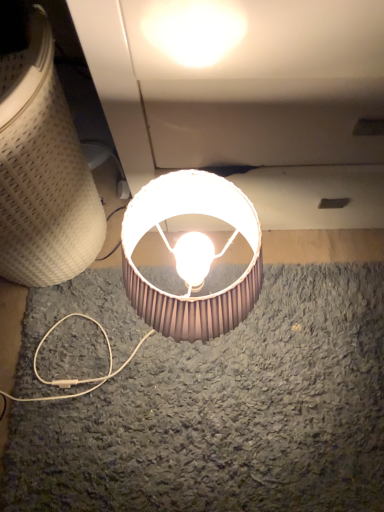
Question: Can you confirm if brown pleated lampshade at center, which is the 1th lamp from right to left, is positioned to the left of matte brown lampshade at lower center, acting as the second lamp starting from the right?

Choices:
 (A) yes
 (B) no

Answer: (B)

Question: From the image's perspective, is brown pleated lampshade at center, which is the 1th lamp from right to left, over matte brown lampshade at lower center, acting as the second lamp starting from the right?

Choices:
 (A) no
 (B) yes

Answer: (A)

Question: Could matte brown lampshade at lower center, marked as the 1th lamp in a left-to-right arrangement, be considered to be inside brown pleated lampshade at center, which is the 1th lamp from right to left?

Choices:
 (A) no
 (B) yes

Answer: (A)

Question: Considering the relative positions of brown pleated lampshade at center, which is the 1th lamp from right to left, and matte brown lampshade at lower center, marked as the 1th lamp in a left-to-right arrangement, in the image provided, is brown pleated lampshade at center, which is the 1th lamp from right to left, behind matte brown lampshade at lower center, marked as the 1th lamp in a left-to-right arrangement,?

Choices:
 (A) no
 (B) yes

Answer: (B)

Question: From a real-world perspective, is brown pleated lampshade at center, which is the 1th lamp from right to left, beneath matte brown lampshade at lower center, acting as the second lamp starting from the right?

Choices:
 (A) yes
 (B) no

Answer: (A)

Question: Does brown pleated lampshade at center, which is the 1th lamp from right to left, appear on the right side of matte brown lampshade at lower center, marked as the 1th lamp in a left-to-right arrangement?

Choices:
 (A) no
 (B) yes

Answer: (B)

Question: Does matte brown lampshade at lower center, marked as the 1th lamp in a left-to-right arrangement, have a smaller size compared to brown pleated lampshade at center, arranged as the second lamp when viewed from the left?

Choices:
 (A) yes
 (B) no

Answer: (B)

Question: Does matte brown lampshade at lower center, acting as the second lamp starting from the right, appear on the left side of brown pleated lampshade at center, arranged as the second lamp when viewed from the left?

Choices:
 (A) no
 (B) yes

Answer: (B)

Question: Is matte brown lampshade at lower center, acting as the second lamp starting from the right, positioned before brown pleated lampshade at center, which is the 1th lamp from right to left?

Choices:
 (A) yes
 (B) no

Answer: (A)

Question: Can you confirm if matte brown lampshade at lower center, marked as the 1th lamp in a left-to-right arrangement, is bigger than brown pleated lampshade at center, arranged as the second lamp when viewed from the left?

Choices:
 (A) no
 (B) yes

Answer: (B)

Question: Does matte brown lampshade at lower center, marked as the 1th lamp in a left-to-right arrangement, come behind brown pleated lampshade at center, which is the 1th lamp from right to left?

Choices:
 (A) no
 (B) yes

Answer: (A)

Question: Considering the relative sizes of matte brown lampshade at lower center, marked as the 1th lamp in a left-to-right arrangement, and brown pleated lampshade at center, which is the 1th lamp from right to left, in the image provided, is matte brown lampshade at lower center, marked as the 1th lamp in a left-to-right arrangement, thinner than brown pleated lampshade at center, which is the 1th lamp from right to left,?

Choices:
 (A) yes
 (B) no

Answer: (B)

Question: Is matte brown lampshade at lower center, marked as the 1th lamp in a left-to-right arrangement, to the left or to the right of brown pleated lampshade at center, which is the 1th lamp from right to left, in the image?

Choices:
 (A) right
 (B) left

Answer: (B)